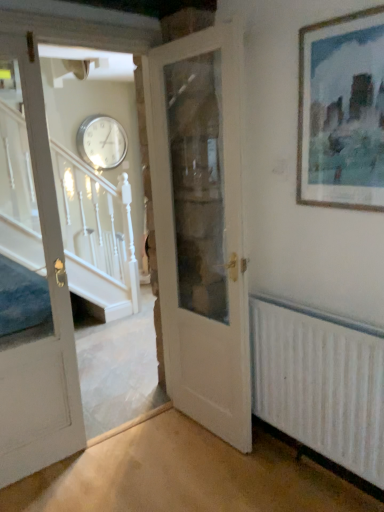
Find the location of a particular element. The height and width of the screenshot is (512, 384). empty space that is ontop of silver metallic clock at upper center (from a real-world perspective) is located at coordinates (98, 116).